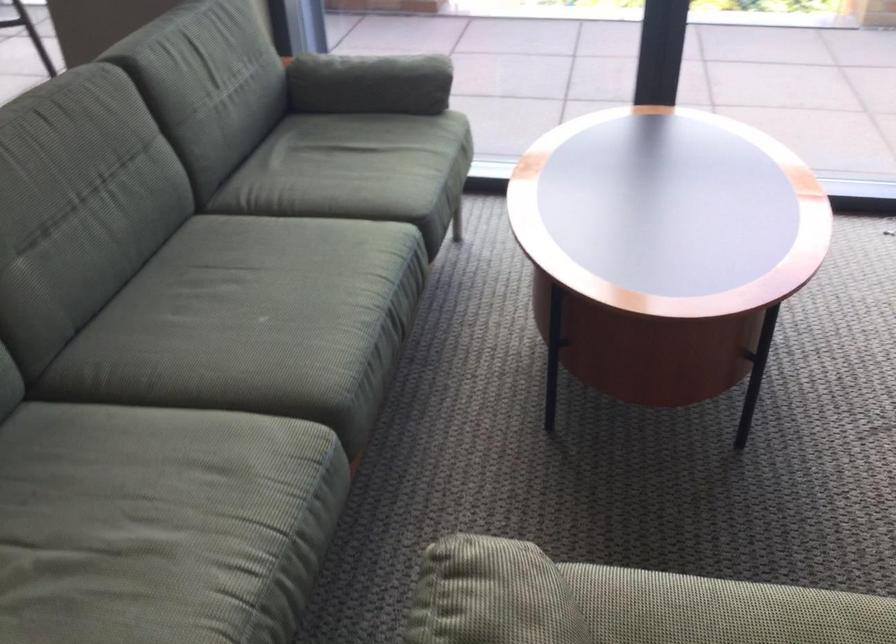
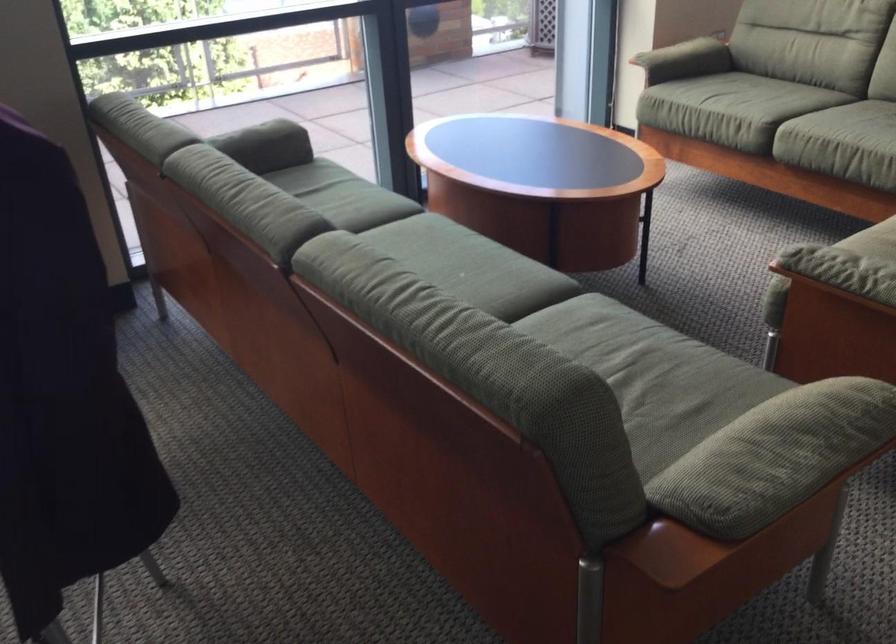
Locate, in the second image, the point that corresponds to pixel 386 76 in the first image.

(265, 140)